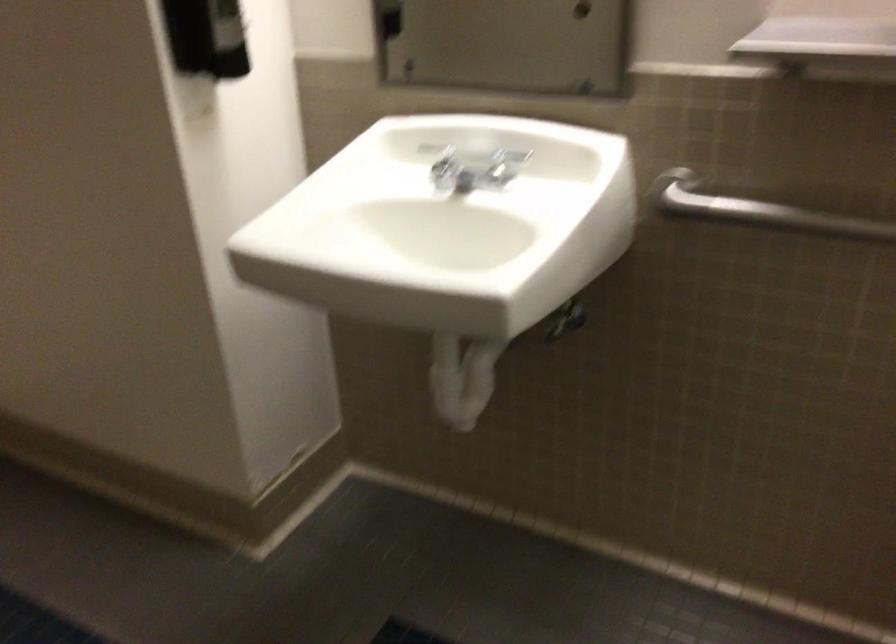
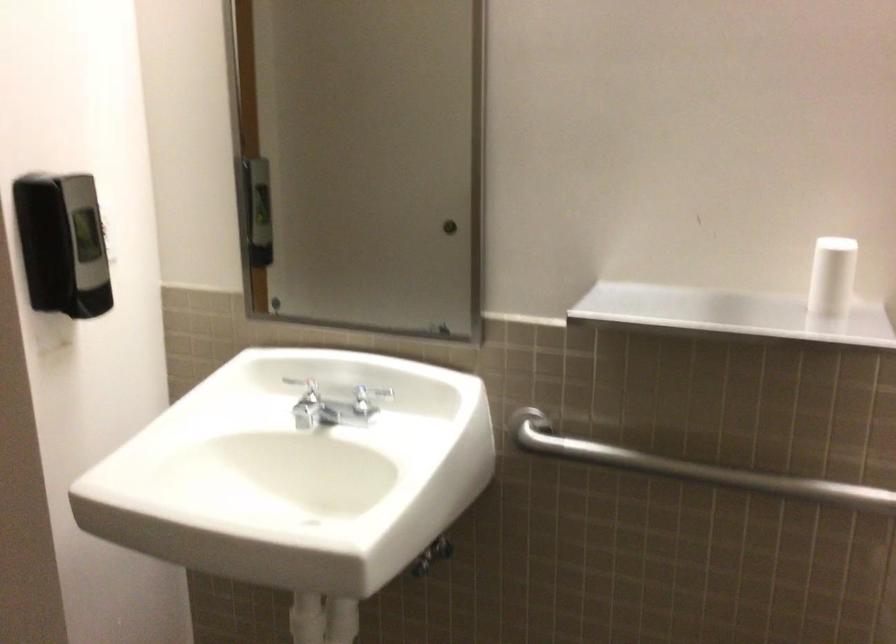
Question: How did the camera likely rotate?

Choices:
 (A) Left
 (B) Right
 (C) Up
 (D) Down

Answer: (C)